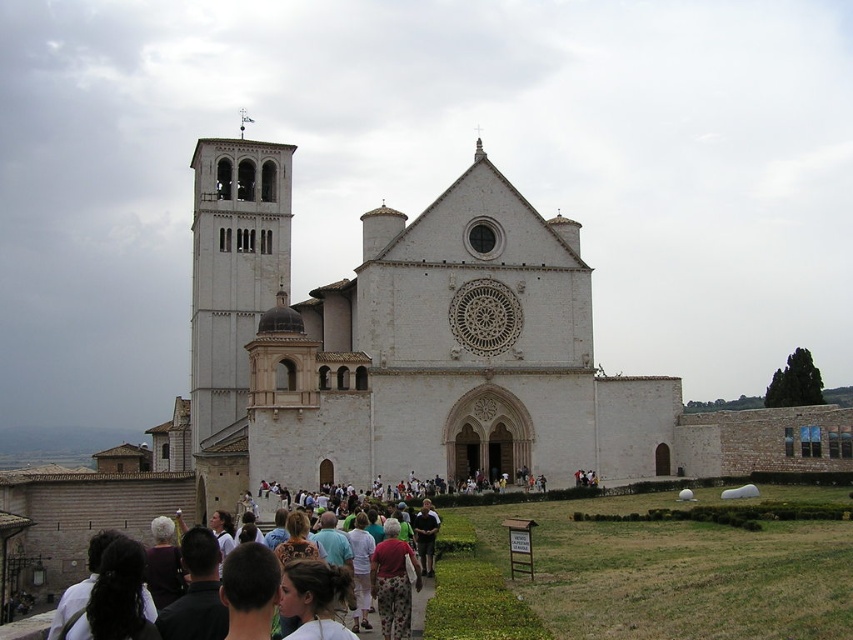
Measure the distance between white stone church at center and white stone bell tower at center-left.

They are 22.23 feet apart.

Is white stone church at center closer to camera compared to white stone bell tower at center-left?

That is True.

You are a GUI agent. You are given a task and a screenshot of the screen. Output one action in this format:
    pyautogui.click(x=<x>, y=<y>)
    Task: Click on the white stone church at center
    The image size is (853, 640).
    Given the screenshot: What is the action you would take?
    pyautogui.click(x=407, y=346)